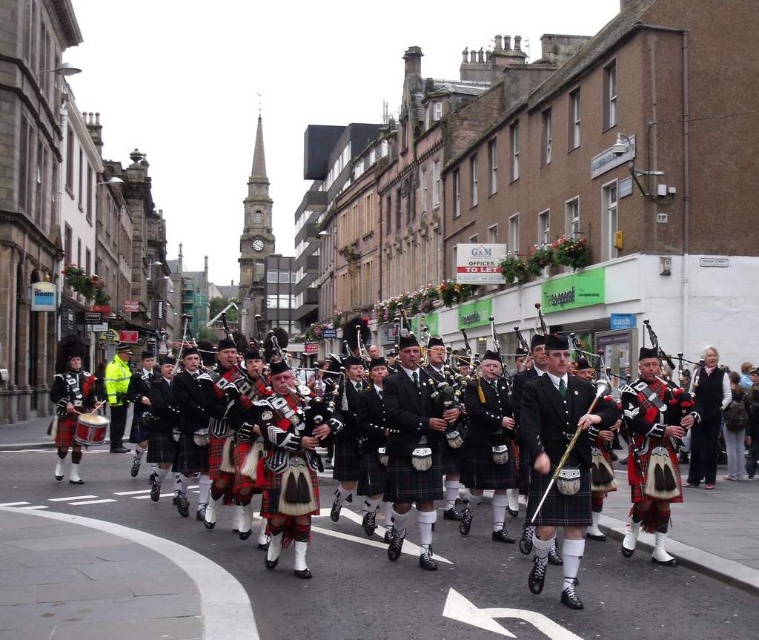
Question: Does matte black kilt at center have a smaller size compared to polished wood bagpipes at center?

Choices:
 (A) yes
 (B) no

Answer: (B)

Question: Which point appears farthest from the camera in this image?

Choices:
 (A) [102, 420]
 (B) [745, 588]
 (C) [586, 504]
 (D) [460, 436]

Answer: (A)

Question: Which object is closer to the camera taking this photo?

Choices:
 (A) polished wood bagpipes at center
 (B) matte black kilt at center
 (C) brass drum at center

Answer: (B)

Question: Is the position of polished wood bagpipes at center less distant than that of brass drum at center?

Choices:
 (A) yes
 (B) no

Answer: (A)

Question: Considering the relative positions of matte black kilt at center and polished wood bagpipes at center in the image provided, where is matte black kilt at center located with respect to polished wood bagpipes at center?

Choices:
 (A) left
 (B) right

Answer: (B)

Question: Which object appears farthest from the camera in this image?

Choices:
 (A) matte black kilt at center
 (B) polished wood bagpipes at center
 (C) brass drum at center

Answer: (C)